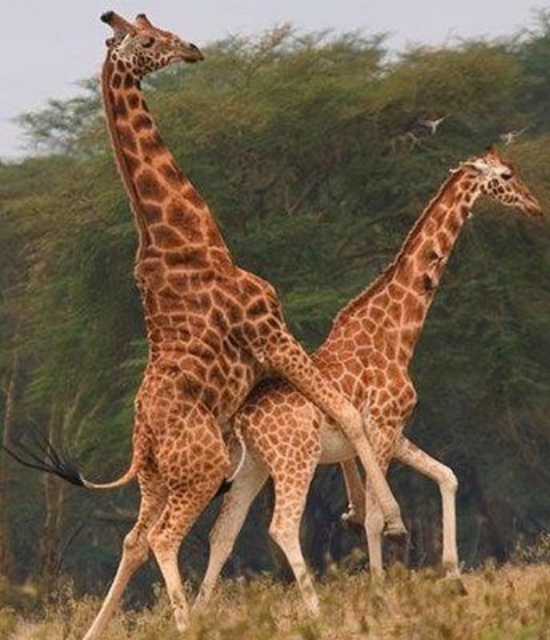
You are a wildlife photographer trying to capture a photo of the spotted fur giraffe at center. You notice that the green grass at lower center is obstructing part of the giraffe. Can you estimate whether the giraffe is wider than the grass area to decide if moving the camera slightly to the right would help frame the giraffe better?

The spotted fur giraffe at center is wider than the green grass at lower center. Moving the camera to the right might help frame the giraffe better since its width surpasses the grass area.

Looking at this image, you are a wildlife photographer aiming to capture a closeup shot of both the spotted fur giraffe at center and the brown spotted giraffe at center in the same frame. Given that your camera has a minimum focus distance of 30 inches, will you be able to focus on both giraffes without moving closer?

The spotted fur giraffe at center and brown spotted giraffe at center are 31.19 inches apart. Since the distance between them is greater than the camera lens minimum focus distance of 30 inches, the camera can focus on both giraffes without moving closer.

You are a wildlife photographer positioned at the camera. You want to capture a closeup shot of the brown spotted giraffe at center. Given that your telephoto lens can focus on subjects within 25 feet, will you be able to take the closeup without moving?

The brown spotted giraffe at center is 25.49 feet away from the camera. Since the telephoto lens can focus within 25 feet, the distance is slightly beyond the lens capability. You will need to move closer or use a different lens to capture the closeup.